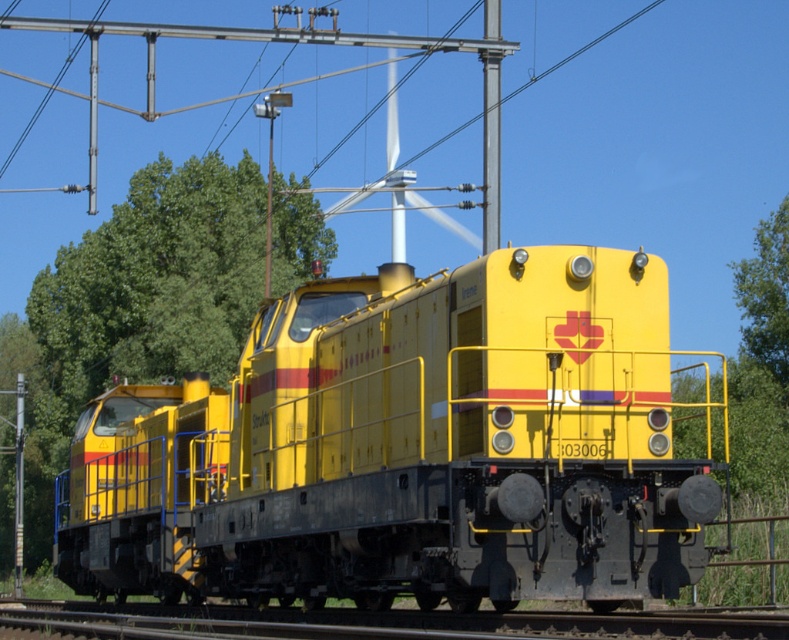
You are a railway inspector checking the alignment of the yellow matte train at center and the metallic pole at upper center. Which object is wider?

The yellow matte train at center is wider than the metallic pole at upper center.

You are a railway inspector checking the positioning of the yellow locomotives. According to the image, what is located at the coordinate point [406,449]?

The yellow matte train at center is located at the coordinate point [406,449].

You are standing at the point with coordinates (406, 449) in the image. What object are you directly facing?

The point at coordinates (406, 449) is directly facing the yellow matte train at center.